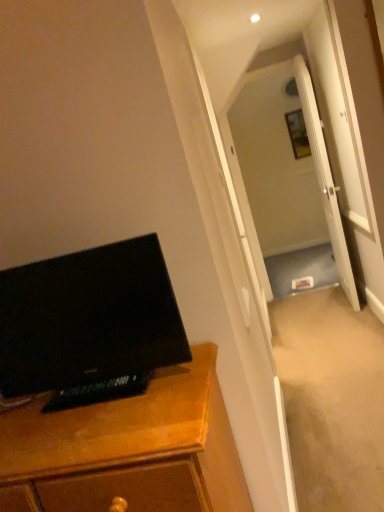
Question: Is white glossy door at center looking in the opposite direction of wooden picture frame at upper center?

Choices:
 (A) no
 (B) yes

Answer: (A)

Question: From a real-world perspective, is white glossy door at center on top of wooden picture frame at upper center?

Choices:
 (A) yes
 (B) no

Answer: (B)

Question: Can you confirm if white glossy door at center is wider than wooden picture frame at upper center?

Choices:
 (A) no
 (B) yes

Answer: (B)

Question: Is white glossy door at center shorter than wooden picture frame at upper center?

Choices:
 (A) yes
 (B) no

Answer: (B)

Question: Is white glossy door at center further to camera compared to wooden picture frame at upper center?

Choices:
 (A) yes
 (B) no

Answer: (B)

Question: Is white glossy door at center to the right of wooden picture frame at upper center from the viewer's perspective?

Choices:
 (A) yes
 (B) no

Answer: (B)

Question: Can white glossy door at center be found inside wooden cabinet at left?

Choices:
 (A) yes
 (B) no

Answer: (B)

Question: From the image's perspective, is wooden cabinet at left above white glossy door at center?

Choices:
 (A) yes
 (B) no

Answer: (B)

Question: Is wooden cabinet at left at the left side of white glossy door at center?

Choices:
 (A) yes
 (B) no

Answer: (A)

Question: Does wooden cabinet at left have a smaller size compared to white glossy door at center?

Choices:
 (A) no
 (B) yes

Answer: (A)

Question: Is wooden cabinet at left positioned with its back to white glossy door at center?

Choices:
 (A) yes
 (B) no

Answer: (A)

Question: From a real-world perspective, is wooden cabinet at left over white glossy door at center?

Choices:
 (A) no
 (B) yes

Answer: (A)

Question: Is wooden picture frame at upper center oriented towards white glossy door at center?

Choices:
 (A) no
 (B) yes

Answer: (B)